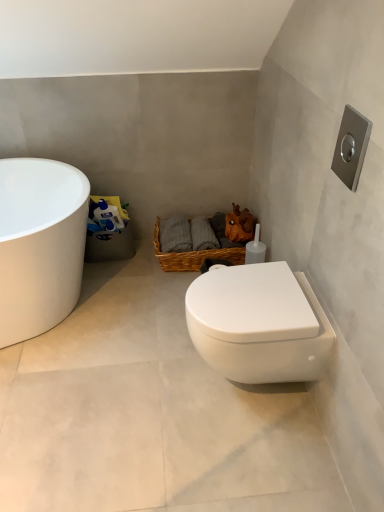
Identify the location of blank space above white glossy toilet at lower right (from a real-world perspective). (254, 292).